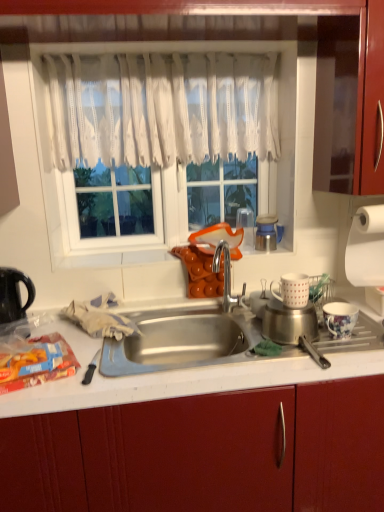
Question: Does orange matte cups at center have a lesser height compared to white matte mug at right, the second appliance in the left-to-right sequence?

Choices:
 (A) no
 (B) yes

Answer: (B)

Question: Is orange matte cups at center positioned before white matte mug at right, the second appliance in the left-to-right sequence?

Choices:
 (A) yes
 (B) no

Answer: (B)

Question: Is orange matte cups at center positioned beyond the bounds of white matte mug at right, which is the fourth appliance from right to left?

Choices:
 (A) yes
 (B) no

Answer: (A)

Question: Is orange matte cups at center positioned behind white matte mug at right, which is the fourth appliance from right to left?

Choices:
 (A) no
 (B) yes

Answer: (B)

Question: Is orange matte cups at center looking in the opposite direction of white matte mug at right, which is the fourth appliance from right to left?

Choices:
 (A) yes
 (B) no

Answer: (B)

Question: Is porcelain floral cup at right, which ranks as the fourth appliance in left-to-right order, spatially inside transparent plastic cup at upper center, the first appliance positioned from the left, or outside of it?

Choices:
 (A) inside
 (B) outside

Answer: (B)

Question: Relative to transparent plastic cup at upper center, the fifth appliance positioned from the right, is porcelain floral cup at right, which ranks as the fourth appliance in left-to-right order, in front or behind?

Choices:
 (A) behind
 (B) front

Answer: (B)

Question: Is point (337, 315) closer or farther from the camera than point (246, 208)?

Choices:
 (A) farther
 (B) closer

Answer: (B)

Question: In terms of height, does porcelain floral cup at right, marked as the second appliance in a right-to-left arrangement, look taller or shorter compared to transparent plastic cup at upper center, the first appliance positioned from the left?

Choices:
 (A) tall
 (B) short

Answer: (B)

Question: From the image's perspective, relative to black plastic kettle at left, is orange matte cups at center above or below?

Choices:
 (A) below
 (B) above

Answer: (B)

Question: Relative to black plastic kettle at left, is orange matte cups at center in front or behind?

Choices:
 (A) behind
 (B) front

Answer: (A)

Question: Does point (286, 250) appear closer or farther from the camera than point (16, 308)?

Choices:
 (A) closer
 (B) farther

Answer: (B)

Question: Considering the positions of orange matte cups at center and black plastic kettle at left in the image, is orange matte cups at center wider or thinner than black plastic kettle at left?

Choices:
 (A) thin
 (B) wide

Answer: (B)

Question: From a real-world perspective, is metallic blue thermos at upper right, the third appliance when ordered from left to right, above or below white lace curtain at upper center?

Choices:
 (A) above
 (B) below

Answer: (B)

Question: Considering the relative positions of metallic blue thermos at upper right, which is the 3th appliance in right-to-left order, and white lace curtain at upper center in the image provided, is metallic blue thermos at upper right, which is the 3th appliance in right-to-left order, to the left or to the right of white lace curtain at upper center?

Choices:
 (A) left
 (B) right

Answer: (B)